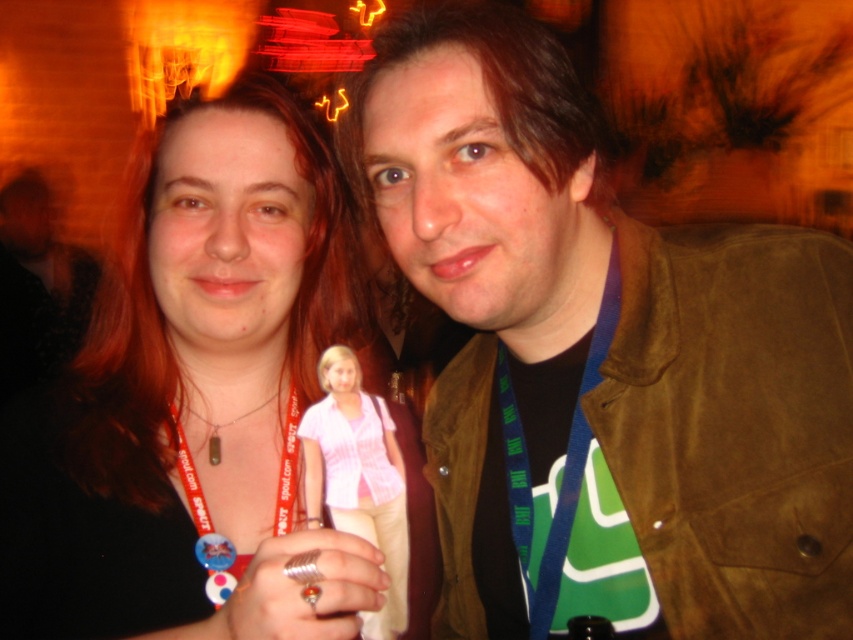
You are a photographer trying to focus on the pink fabric shirt at center and the matte black necklace at center. Which object is located to the left of the other?

The matte black necklace at center is positioned on the left side of pink fabric shirt at center.